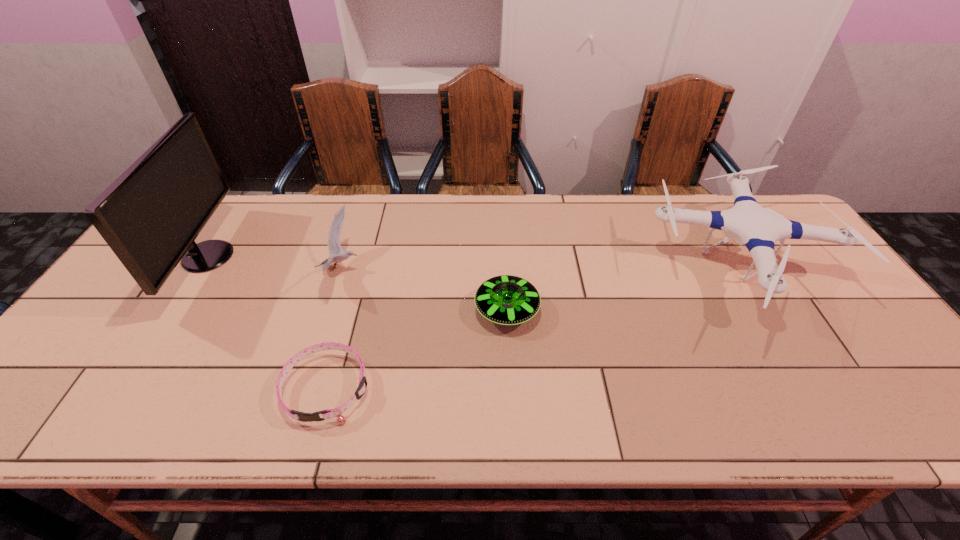
Find the location of `free space in the image that satisfies the following two spatial constraints: 1. on the front-facing side of the leftmost object; 2. on the back side of the fourth shortest object`. free space in the image that satisfies the following two spatial constraints: 1. on the front-facing side of the leftmost object; 2. on the back side of the fourth shortest object is located at coordinates click(x=201, y=269).

The height and width of the screenshot is (540, 960). I want to click on vacant area that satisfies the following two spatial constraints: 1. on the back side of the rightmost object; 2. on the front-facing side of the computer monitor, so click(x=732, y=256).

Find the location of a particular element. free spot that satisfies the following two spatial constraints: 1. at the tip of the beak of the second object from right to left; 2. on the left side of the gull is located at coordinates (328, 310).

You are a GUI agent. You are given a task and a screenshot of the screen. Output one action in this format:
    pyautogui.click(x=<x>, y=<y>)
    Task: Click on the free space that satisfies the following two spatial constraints: 1. on the front-facing side of the leftmost object; 2. on the right side of the drone
    
    Given the screenshot: What is the action you would take?
    pyautogui.click(x=201, y=269)